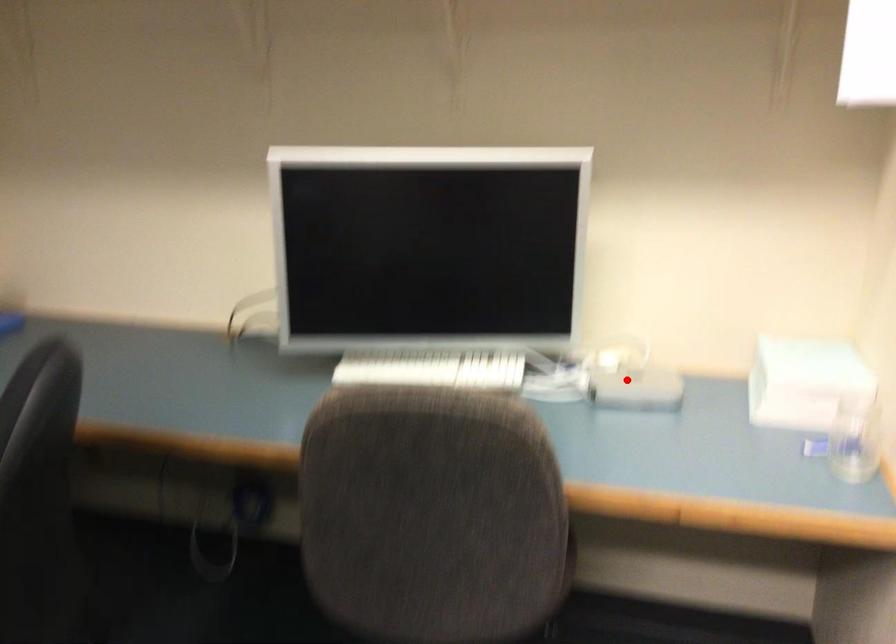
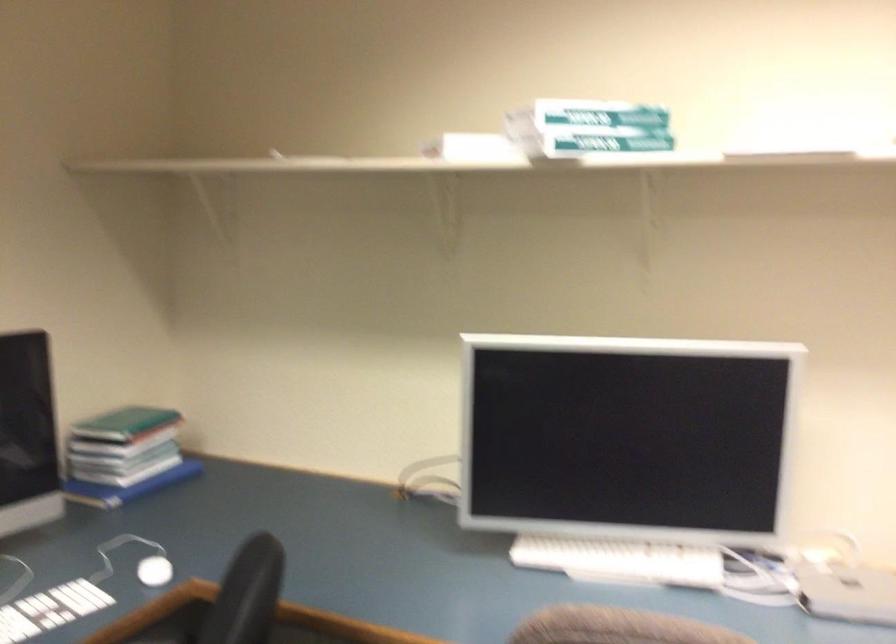
Where in the second image is the point corresponding to the highlighted location from the first image?

(846, 591)